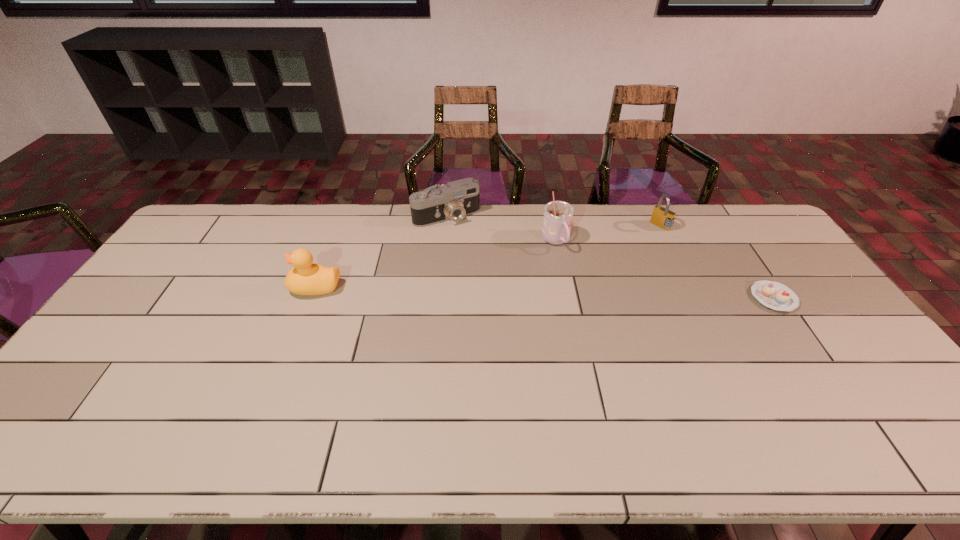
Identify the location of vacant space on the desktop that is between the duck and the rightmost object and is positioned on the side with the combination dials of the padlock. (577, 293).

What are the coordinates of `vacant space on the desktop that is between the duck and the rightmost object and is positioned on the side with the handle of the cup` in the screenshot? It's located at (592, 294).

Identify the location of free spot on the desktop that is between the leftmost object and the rightmost object and is positioned on the lens of the fourth object from right to left. The width and height of the screenshot is (960, 540). (498, 291).